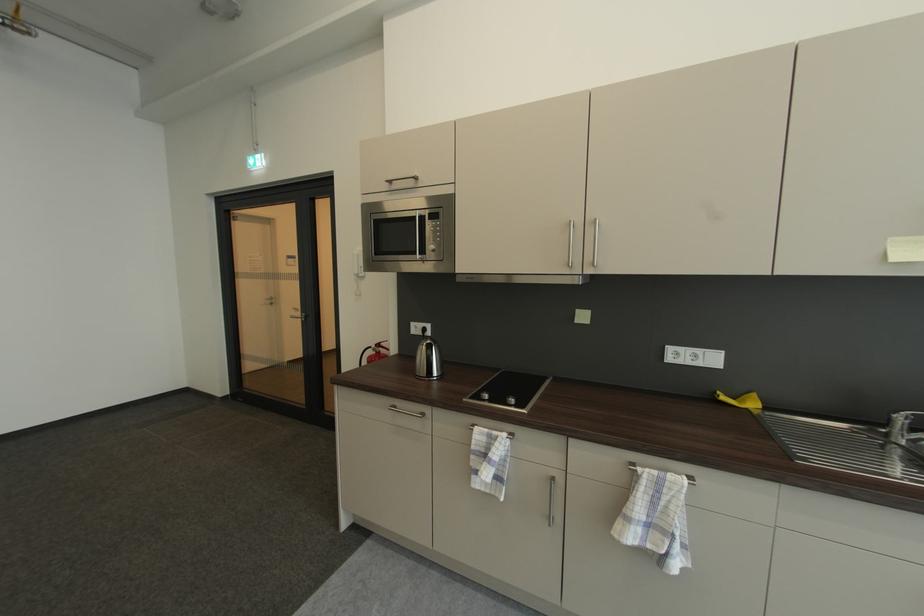
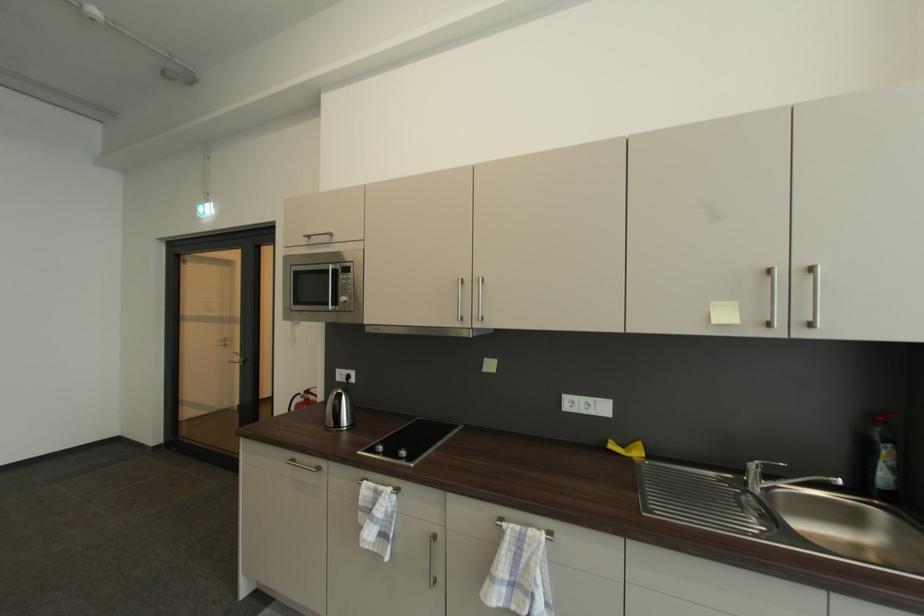
Locate, in the second image, the point that corresponds to pixel 435 353 in the first image.

(344, 403)